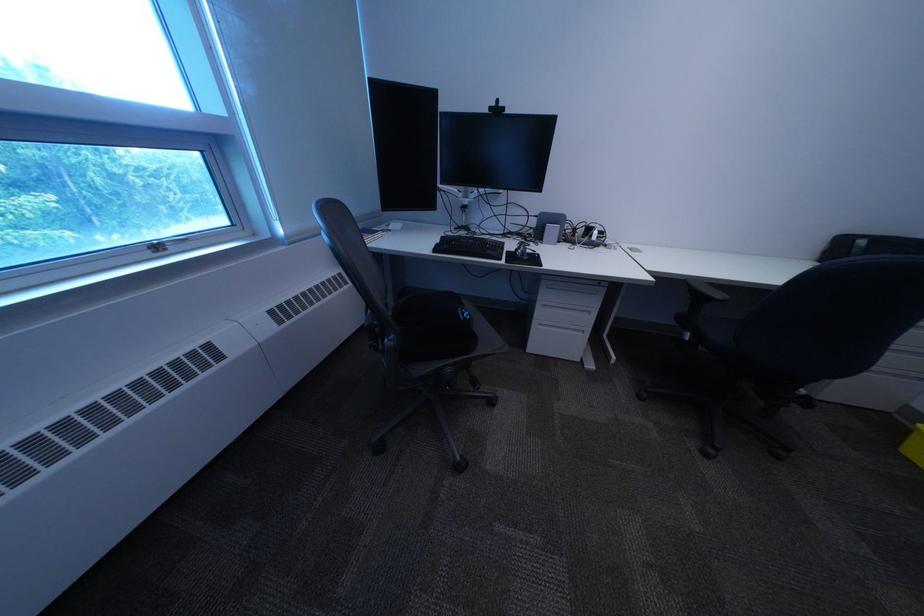
The image size is (924, 616). I want to click on black chair armrest, so click(422, 323).